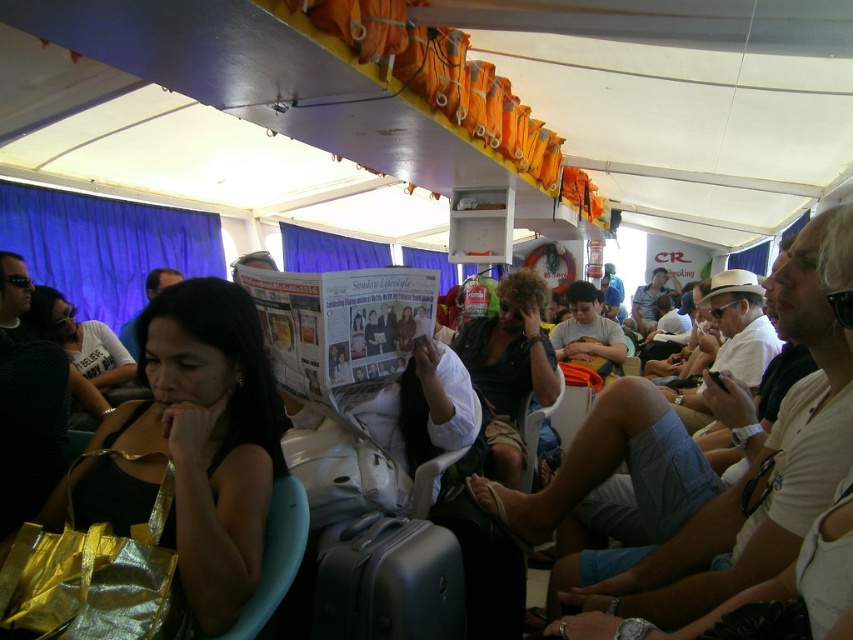
What is the exact coordinate position of the shiny gold bag at center?

The shiny gold bag at center is located at the coordinate point of [190,445].

In the scene shown: You are a passenger on a ferry and you see a shiny gold bag at center and a dark brown leather jacket at center. Which item is located to the left of the other?

The shiny gold bag at center is positioned on the left side of dark brown leather jacket at center.